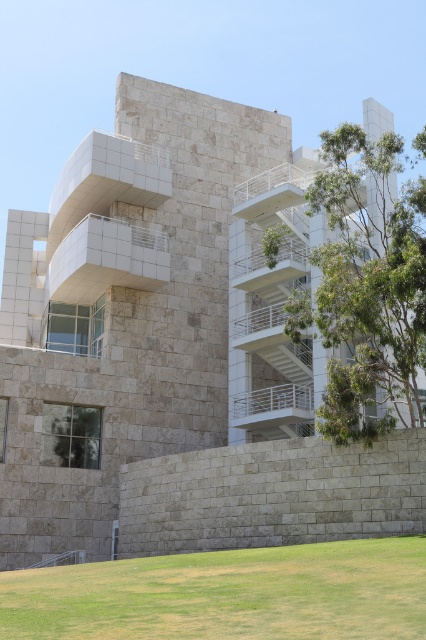
Is point (149, 627) farther from camera compared to point (363, 148)?

No, it is not.

Which is below, green grass at lower center or green leafy tree at right?

Positioned lower is green grass at lower center.

Identify the location of green grass at lower center. (227, 595).